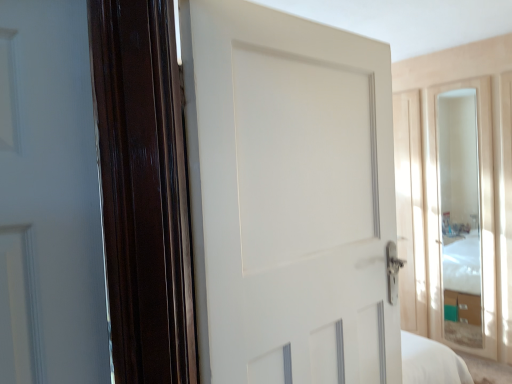
Question: Does point (268, 200) appear closer or farther from the camera than point (474, 296)?

Choices:
 (A) farther
 (B) closer

Answer: (B)

Question: Considering the positions of white matte door at center and clear glass mirror at right in the image, is white matte door at center taller or shorter than clear glass mirror at right?

Choices:
 (A) short
 (B) tall

Answer: (A)

Question: Based on their sizes in the image, would you say white matte door at center is bigger or smaller than clear glass mirror at right?

Choices:
 (A) small
 (B) big

Answer: (B)

Question: Do you think clear glass mirror at right is within white matte door at center, or outside of it?

Choices:
 (A) inside
 (B) outside

Answer: (B)

Question: From the image's perspective, is clear glass mirror at right located above or below white matte door at center?

Choices:
 (A) below
 (B) above

Answer: (A)

Question: Based on their positions, is clear glass mirror at right located to the left or right of white matte door at center?

Choices:
 (A) left
 (B) right

Answer: (B)

Question: Looking at their shapes, would you say clear glass mirror at right is wider or thinner than white matte door at center?

Choices:
 (A) wide
 (B) thin

Answer: (B)